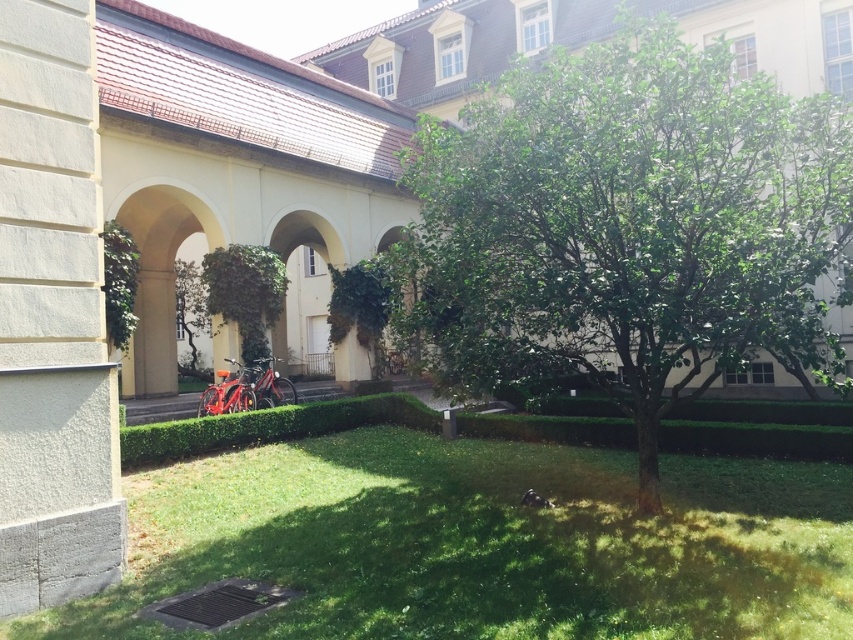
Is green leafy tree at center positioned behind green leafy hedge at center?

No, it is not.

At what (x,y) coordinates should I click in order to perform the action: click on green leafy tree at center. Please return your answer as a coordinate pair (x, y). The image size is (853, 640). Looking at the image, I should click on (625, 227).

I want to click on green leafy tree at center, so click(x=625, y=227).

From the picture: Is green leafy tree at center thinner than green grass at lower center?

Yes, green leafy tree at center is thinner than green grass at lower center.

Find the location of a particular element. This screenshot has width=853, height=640. green leafy tree at center is located at coordinates (625, 227).

This screenshot has width=853, height=640. I want to click on green leafy tree at center, so click(x=625, y=227).

Identify the location of green leafy tree at center. (625, 227).

Who is positioned more to the right, green grass at lower center or green leafy hedge at center?

green grass at lower center is more to the right.

Identify the location of green grass at lower center. The width and height of the screenshot is (853, 640). (480, 545).

Who is more distant from viewer, (773, 525) or (120, 467)?

Point (773, 525)

Where is `green grass at lower center`? The image size is (853, 640). green grass at lower center is located at coordinates (480, 545).